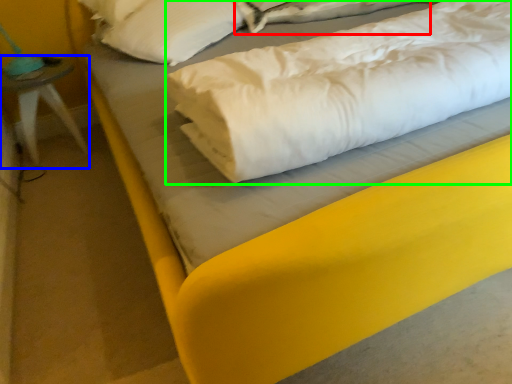
Question: Based on their relative distances, which object is nearer to sheet (highlighted by a red box)? Choose from furniture (highlighted by a blue box) and linen (highlighted by a green box).

Choices:
 (A) furniture
 (B) linen

Answer: (B)